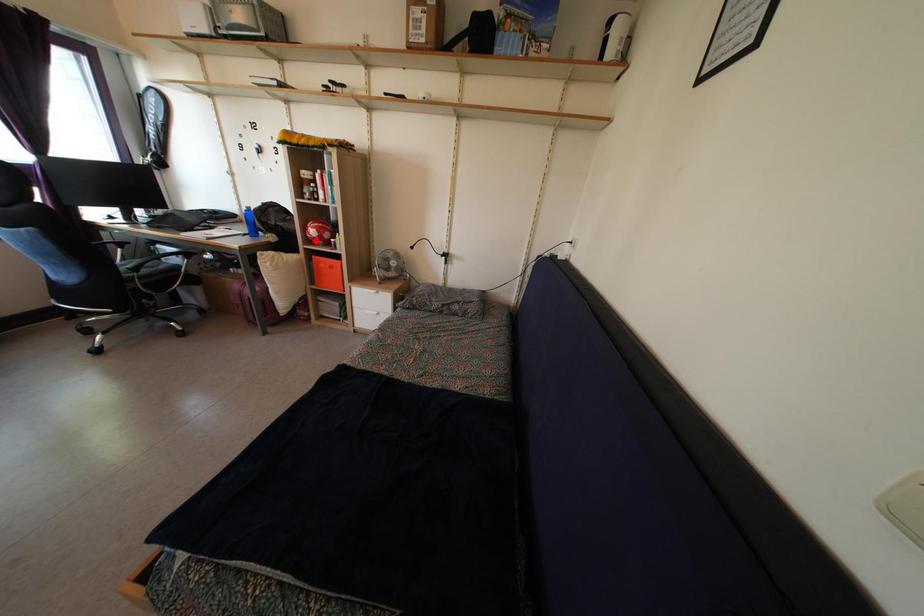
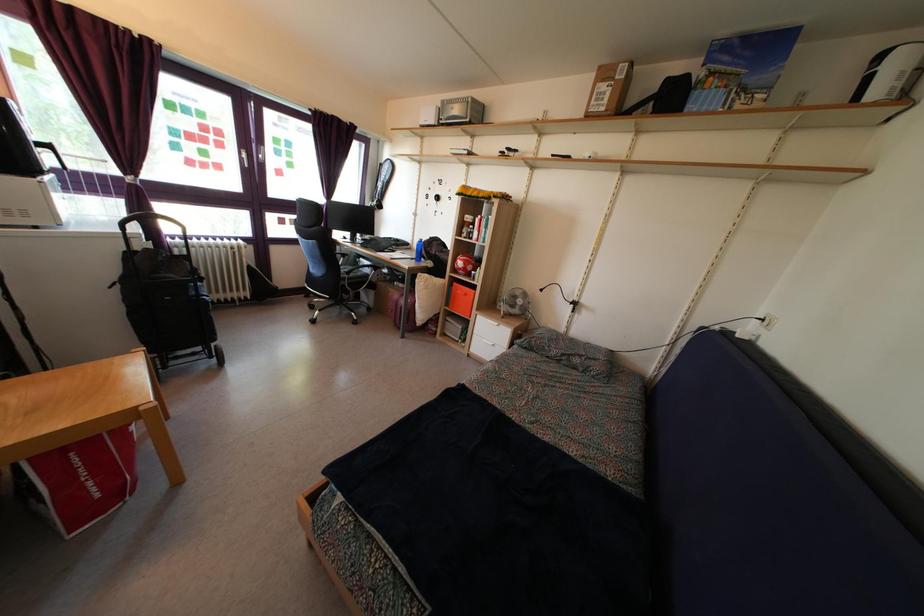
In the second image, find the point that corresponds to the highlighted location in the first image.

(463, 272)